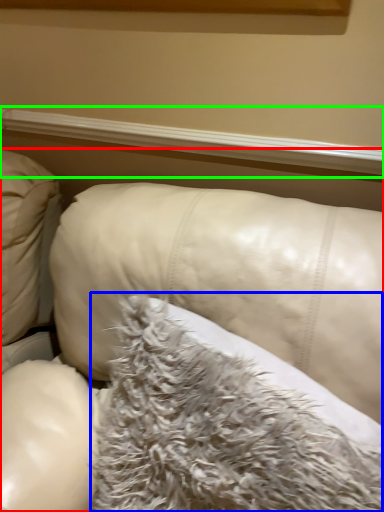
Question: Which object is the closest to the furniture (highlighted by a red box)? Choose among these: pillow (highlighted by a blue box) or window sill (highlighted by a green box).

Choices:
 (A) pillow
 (B) window sill

Answer: (A)